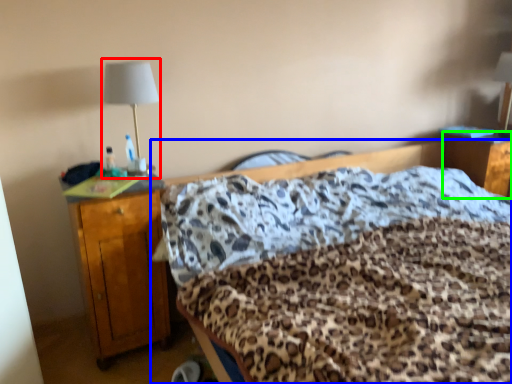
Question: Estimate the real-world distances between objects in this image. Which object is closer to bedside lamp (highlighted by a red box), bed (highlighted by a blue box) or nightstand (highlighted by a green box)?

Choices:
 (A) bed
 (B) nightstand

Answer: (A)